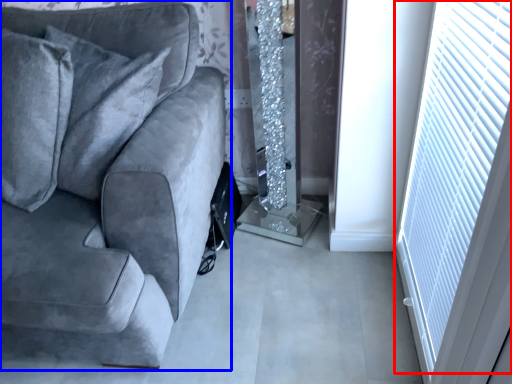
Question: Which object is closer to the camera taking this photo, blind (highlighted by a red box) or studio couch (highlighted by a blue box)?

Choices:
 (A) blind
 (B) studio couch

Answer: (A)